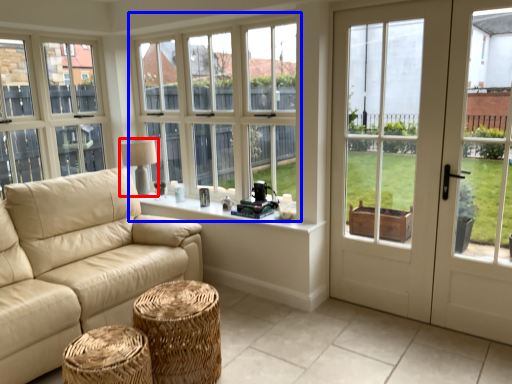
Question: Which point is closer to the camera, table lamp (highlighted by a red box) or window (highlighted by a blue box)?

Choices:
 (A) table lamp
 (B) window

Answer: (B)